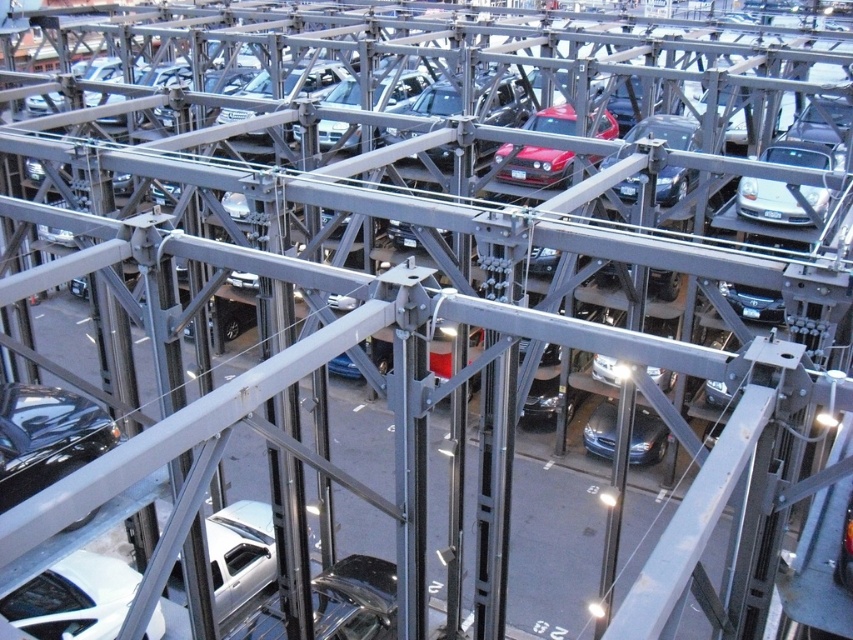
You are a delivery driver who needs to park your truck in the parking structure. You see a silver metallic car at center right and a metallic blue sedan at center. Which vehicle takes up more space in their parking spot?

The silver metallic car at center right is bigger than the metallic blue sedan at center, so it takes up more space in their parking spot.

You are a parking attendant who needs to fit a compact car into a space between the silver metallic car at center right and the shiny red car at center. Based on their widths, can the compact car fit between them?

The silver metallic car at center right is wider than the shiny red car at center. Since the compact car requires a space narrower than the silver metallic car at center right but wider than the shiny red car at center, it depends on the exact width of the compact car. However, since the space between them would be the difference between their widths, it might not be suitable. Without specific measurements, it is uncertain.